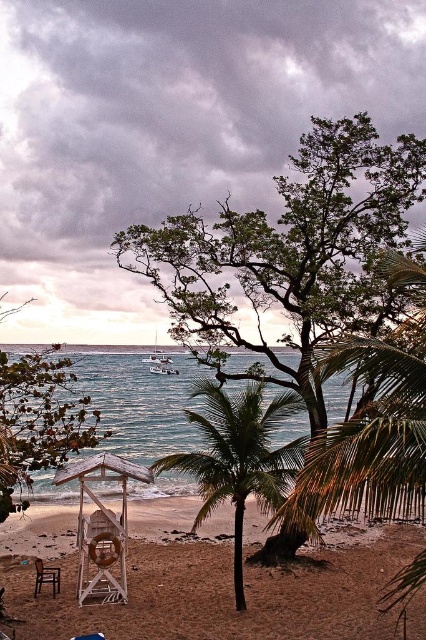
In the scene shown: You are standing on the beach and want to take a photo of the green leafy palm tree at center. If your camera can focus on objects up to 30 feet away, will you need to adjust your position to capture it clearly?

The green leafy palm tree at center is 35.78 feet away from the viewer, which exceeds the camera focus limit of 30 feet. You need to move closer to ensure it is within range.

You are standing at the center of the beach and want to move towards the ocean. There is a white plastic lifeguard chair at lower center in your way. Can you walk around it easily?

The white plastic lifeguard chair at lower center is located at point (207, 588). Since it is a single chair, you can easily walk around it to reach the ocean.

You are a maintenance worker needing to reach the wooden beach chair at lower left from the green leafy palm tree at center. Can you walk directly to it without any obstacles?

The distance between the green leafy palm tree at center and the wooden beach chair at lower left is 3.71 meters. There are no mentioned obstacles in the scene description, so you can walk directly to it.